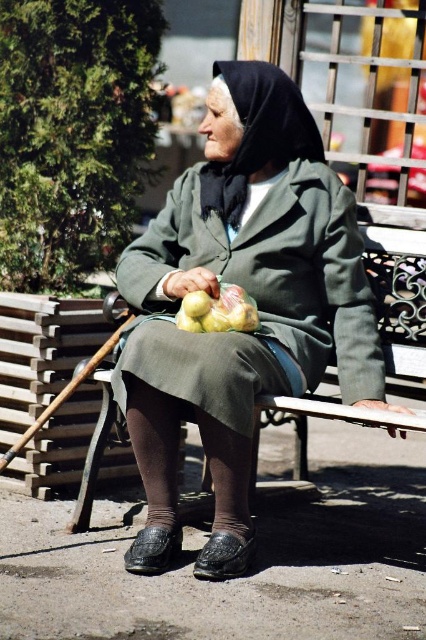
Question: Which point is closer to the camera?

Choices:
 (A) yellow matte apples at center
 (B) matte green coat at center

Answer: (B)

Question: Which object is closer to the camera taking this photo?

Choices:
 (A) matte green coat at center
 (B) yellow matte apples at center

Answer: (A)

Question: Is matte green coat at center positioned before yellow matte apples at center?

Choices:
 (A) no
 (B) yes

Answer: (B)

Question: Is the position of matte green coat at center more distant than that of yellow matte apples at center?

Choices:
 (A) no
 (B) yes

Answer: (A)

Question: Does matte green coat at center have a larger size compared to yellow matte apples at center?

Choices:
 (A) yes
 (B) no

Answer: (A)